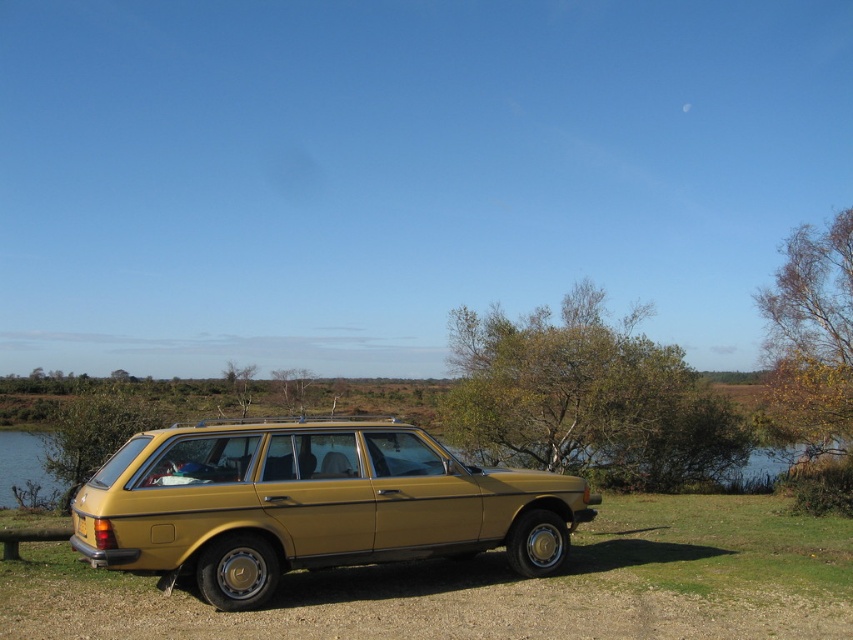
You are standing at the point marked as point (500, 586) in the image. What is the surface you are currently standing on?

The point (500, 586) is on green grass at center, so you are standing on green grass.

You are a photographer planning to take a picture of the green grass at center and the gold metallic station wagon at center. Which object will appear taller in the photo?

The gold metallic station wagon at center will appear taller in the photo since the green grass at center has a lesser height compared to it.